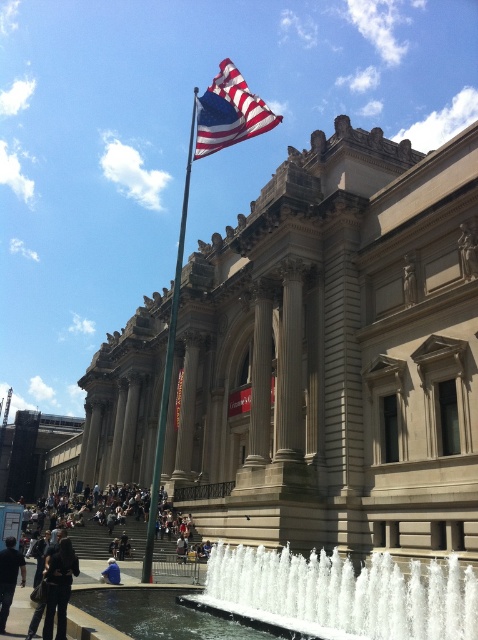
Question: Estimate the real-world distances between objects in this image. Which object is closer to the american flag at upper center?

Choices:
 (A) beige stone column at center
 (B) green metallic flag pole at upper center
 (C) white water at center
 (D) white marble pillar at center

Answer: (D)

Question: Among these objects, which one is farthest from the camera?

Choices:
 (A) green metallic flag pole at upper center
 (B) beige stone column at center
 (C) american flag at upper center
 (D) blue denim jeans at lower center

Answer: (B)

Question: Is american flag at upper center closer to camera compared to dark gray pants at lower left?

Choices:
 (A) no
 (B) yes

Answer: (A)

Question: Which of the following is the closest to the observer?

Choices:
 (A) (206, 125)
 (B) (109, 568)
 (C) (251, 584)

Answer: (C)

Question: Observing the image, what is the correct spatial positioning of green metallic flag pole at upper center in reference to dark brown leather jacket at lower left?

Choices:
 (A) right
 (B) left

Answer: (B)

Question: Is dark gray pants at lower left further to the viewer compared to blue denim jeans at lower center?

Choices:
 (A) no
 (B) yes

Answer: (A)